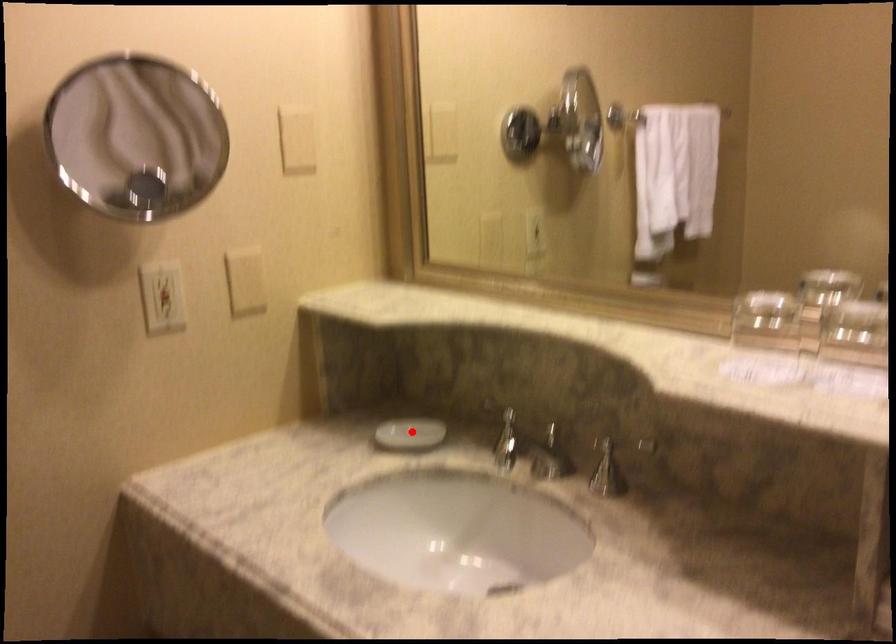
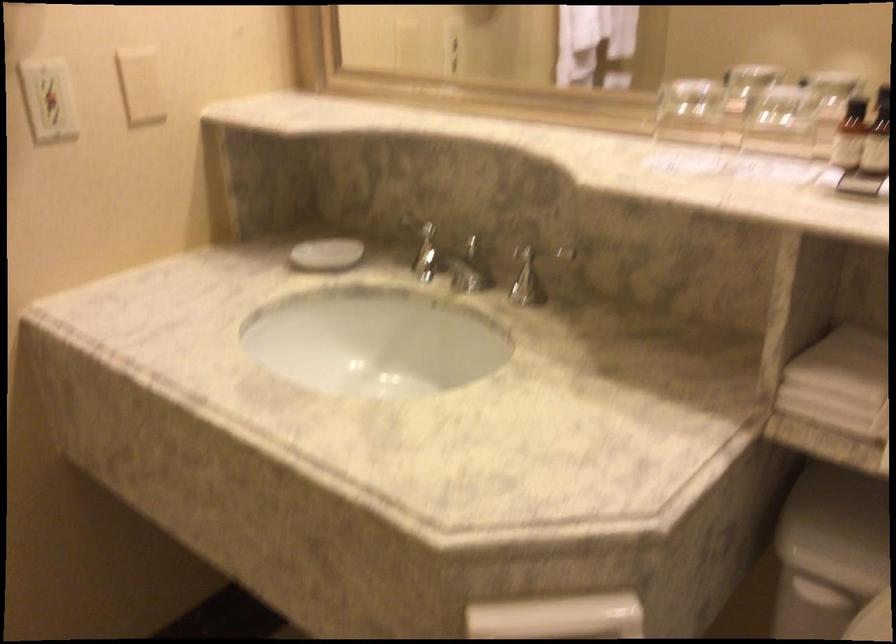
In the second image, find the point that corresponds to the highlighted location in the first image.

(325, 254)